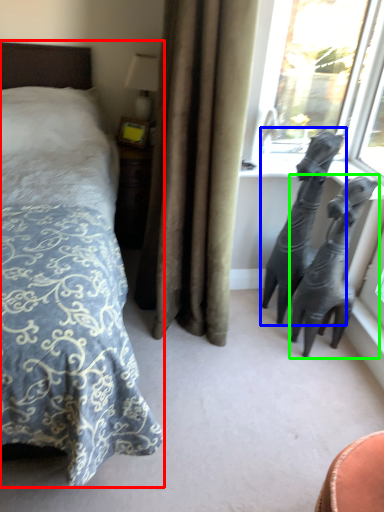
Question: Which is nearer to the bed (highlighted by a red box)? animal (highlighted by a blue box) or bronze sculpture (highlighted by a green box).

Choices:
 (A) animal
 (B) bronze sculpture

Answer: (A)